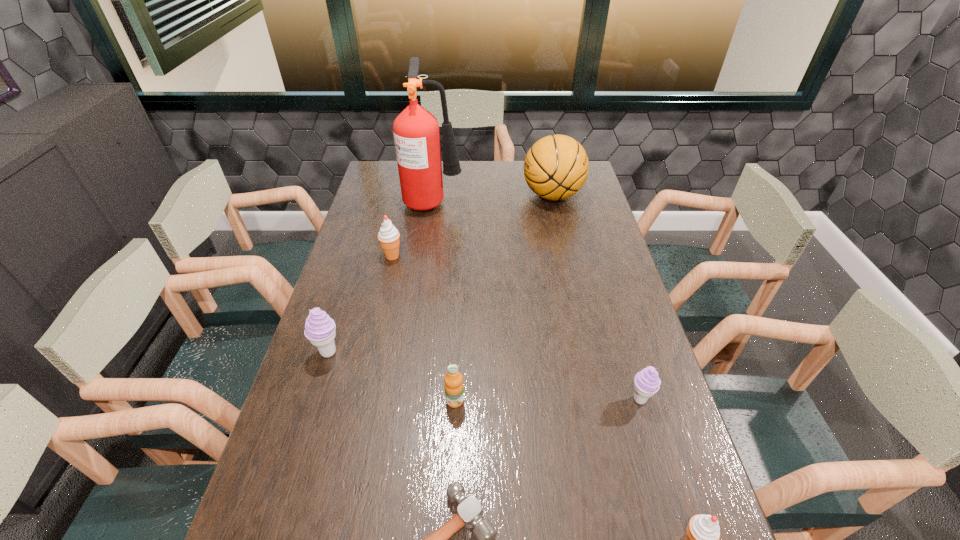
The image size is (960, 540). In order to click on the tallest object in this screenshot , I will do `click(416, 133)`.

Locate an element on the screen. Image resolution: width=960 pixels, height=540 pixels. fire extinguisher is located at coordinates (416, 133).

You are a GUI agent. You are given a task and a screenshot of the screen. Output one action in this format:
    pyautogui.click(x=<x>, y=<y>)
    Task: Click on the seventh shortest object
    
    Given the screenshot: What is the action you would take?
    (x=556, y=167)

Where is `orange basketball`? orange basketball is located at coordinates (556, 167).

Where is `the sixth nearest object`? Image resolution: width=960 pixels, height=540 pixels. the sixth nearest object is located at coordinates (388, 236).

What are the coordinates of `the bigger red icecream` in the screenshot? It's located at (388, 236).

Where is `the bigger purple icecream`? the bigger purple icecream is located at coordinates (319, 328).

Locate an element on the screen. This screenshot has height=540, width=960. the third nearest icecream is located at coordinates (319, 328).

Identify the location of orange juice. This screenshot has height=540, width=960. (454, 394).

Locate an element on the screen. The image size is (960, 540). the second nearest icecream is located at coordinates (646, 383).